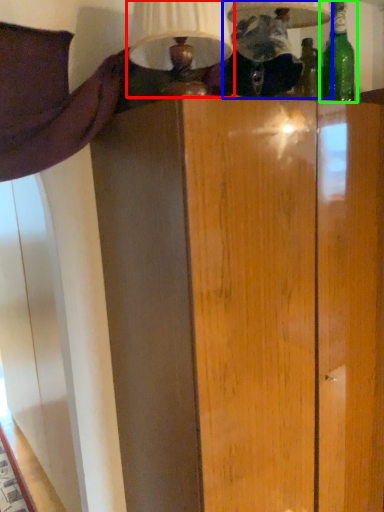
Question: Which object is the closest to the table lamp (highlighted by a red box)? Choose among these: table lamp (highlighted by a blue box) or bottle (highlighted by a green box).

Choices:
 (A) table lamp
 (B) bottle

Answer: (A)